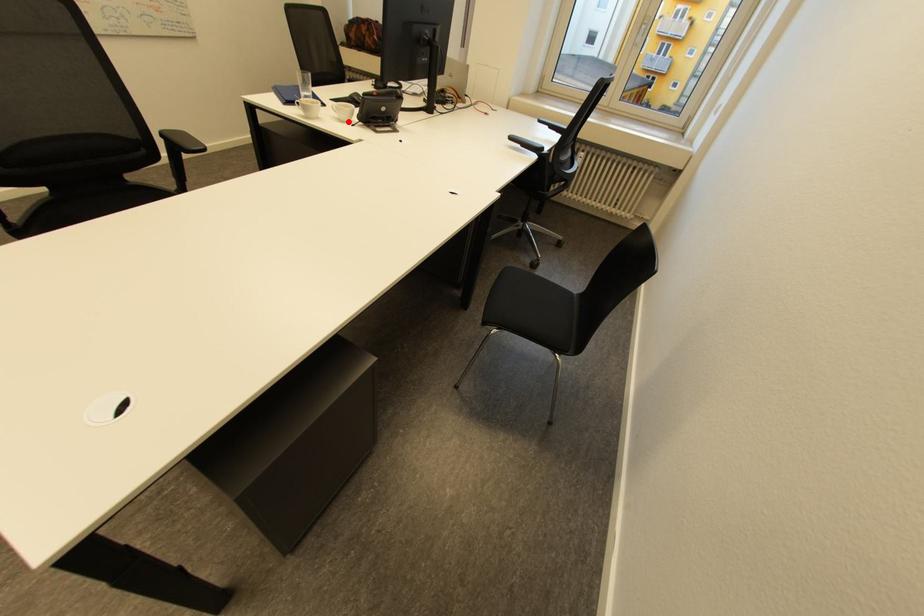
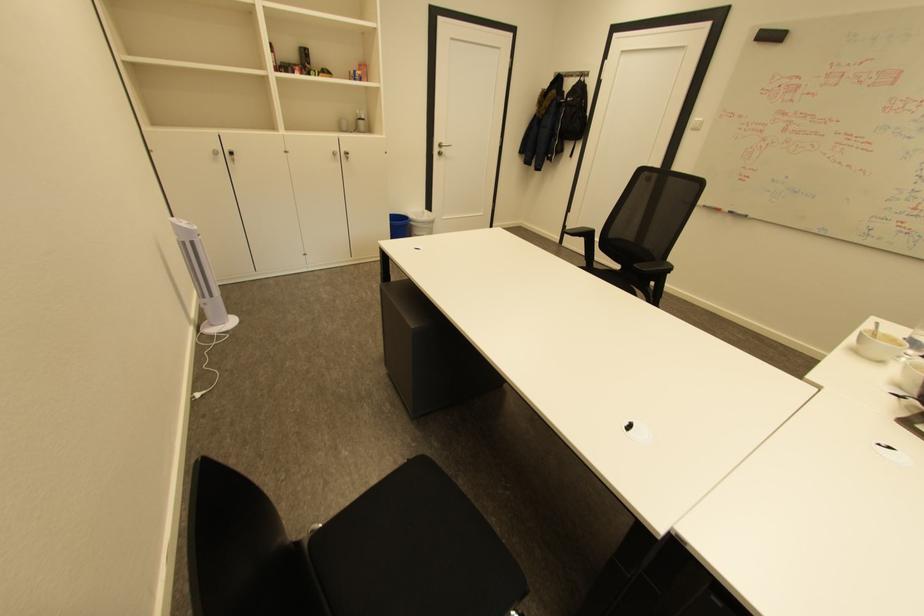
Where in the second image is the point corresponding to the highlighted location from the first image?

(906, 386)